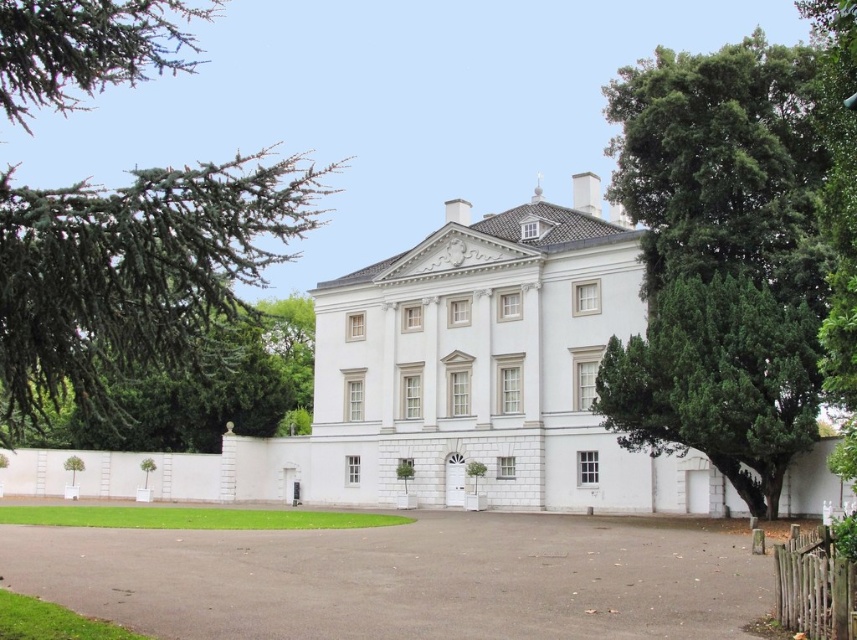
Is point (78, 552) more distant than point (255, 200)?

Yes, it is behind point (255, 200).

Between point (508, 621) and point (9, 419), which one is positioned in front?

Point (508, 621)

Which is in front, point (351, 580) or point (31, 246)?

Point (31, 246) is more forward.

Find the location of a particular element. The height and width of the screenshot is (640, 857). gray asphalt driveway at lower center is located at coordinates (405, 579).

Is gray asphalt driveway at lower center shorter than green textured tree at right?

Correct, gray asphalt driveway at lower center is not as tall as green textured tree at right.

Find the location of a particular element. Image resolution: width=857 pixels, height=640 pixels. gray asphalt driveway at lower center is located at coordinates (405, 579).

Looking at this image, does green needle-like branches at upper left appear on the right side of green textured tree at right?

In fact, green needle-like branches at upper left is to the left of green textured tree at right.

Who is shorter, green needle-like branches at upper left or green textured tree at right?

Standing shorter between the two is green textured tree at right.

Who is more forward, (42, 45) or (814, 323)?

Point (42, 45)

Image resolution: width=857 pixels, height=640 pixels. What are the coordinates of `green needle-like branches at upper left` in the screenshot? It's located at (135, 275).